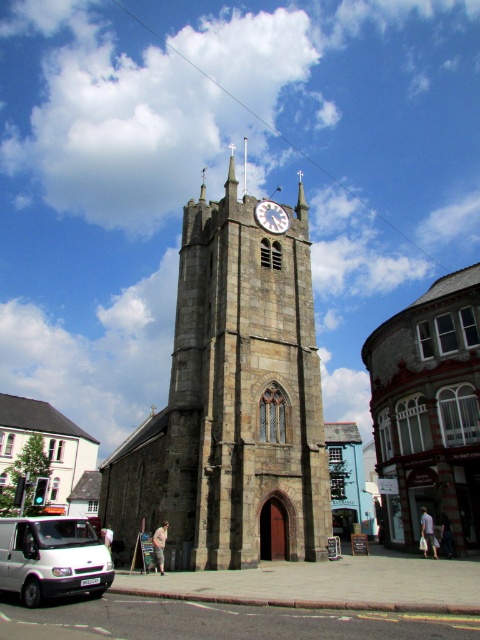
Which is below, stone church at center or white matte van at lower left?

white matte van at lower left

Between point (403, 538) and point (64, 522), which one is positioned in front?

Point (64, 522) is in front.

Who is more forward, (467, 307) or (56, 548)?

Point (56, 548) is more forward.

This screenshot has height=640, width=480. In order to click on stone church at center in this screenshot , I will do `click(429, 410)`.

Can you confirm if stone clock tower at center is positioned to the left of stone church at center?

Yes, stone clock tower at center is to the left of stone church at center.

Does stone clock tower at center have a greater height compared to stone church at center?

Correct, stone clock tower at center is much taller as stone church at center.

Identify the location of stone clock tower at center. (233, 401).

Who is taller, stone clock tower at center or white glossy clock at upper center?

stone clock tower at center

Does stone clock tower at center appear under white glossy clock at upper center?

No, stone clock tower at center is not below white glossy clock at upper center.

Is point (265, 481) closer to camera compared to point (280, 211)?

Yes, point (265, 481) is closer to viewer.

I want to click on stone clock tower at center, so click(233, 401).